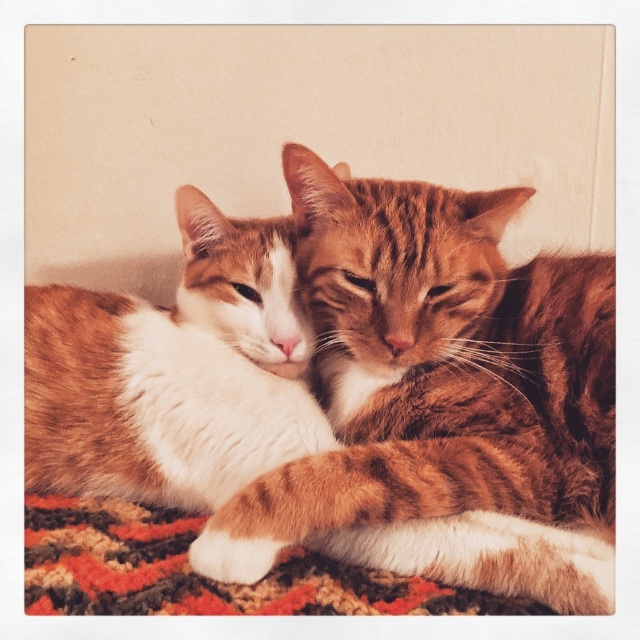
Question: Can you confirm if orange tabby cat at center is thinner than white fur cat at center?

Choices:
 (A) yes
 (B) no

Answer: (B)

Question: Which point is closer to the camera?

Choices:
 (A) carpeted mat at lower center
 (B) white fur cat at center
 (C) orange tabby cat at center

Answer: (A)

Question: Which point is farther to the camera?

Choices:
 (A) (476, 484)
 (B) (188, 531)
 (C) (51, 356)

Answer: (C)

Question: Can you confirm if orange tabby cat at center is positioned below carpeted mat at lower center?

Choices:
 (A) no
 (B) yes

Answer: (A)

Question: Which point is closer to the camera?

Choices:
 (A) carpeted mat at lower center
 (B) orange tabby cat at center
 (C) white fur cat at center

Answer: (A)

Question: In this image, where is orange tabby cat at center located relative to white fur cat at center?

Choices:
 (A) right
 (B) left

Answer: (A)